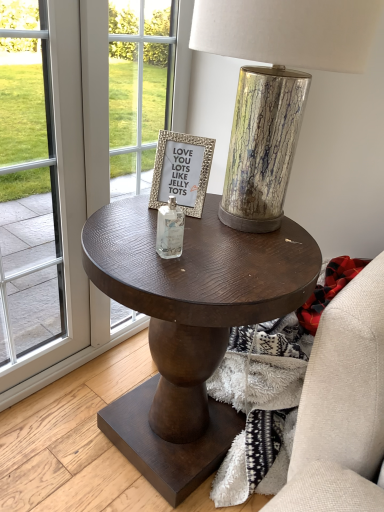
Locate an element on the screen. free space between metallic cracked glass table lamp at center and clear glass bottle at center is located at coordinates (198, 249).